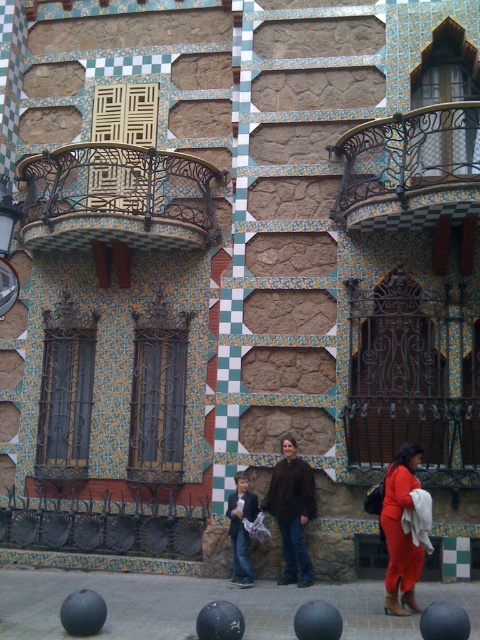
Question: Is matte orange dress at lower right thinner than denim jacket at center?

Choices:
 (A) no
 (B) yes

Answer: (B)

Question: Can you confirm if dark brown wrought iron balcony at upper left is positioned below brown leather jacket at center?

Choices:
 (A) no
 (B) yes

Answer: (A)

Question: Which of the following is the farthest from the observer?

Choices:
 (A) (447, 125)
 (B) (385, 600)
 (C) (127, 227)

Answer: (C)

Question: Estimate the real-world distances between objects in this image. Which object is closer to the denim jacket at center?

Choices:
 (A) matte orange dress at lower right
 (B) brown leather jacket at center
 (C) dark brown wrought iron balcony at upper left

Answer: (B)

Question: Which point appears closest to the camera in this image?

Choices:
 (A) (241, 513)
 (B) (405, 496)
 (C) (287, 536)
 (D) (384, 186)

Answer: (B)

Question: Observing the image, what is the correct spatial positioning of black wrought iron balcony at upper right in reference to brown leather jacket at center?

Choices:
 (A) above
 (B) below

Answer: (A)